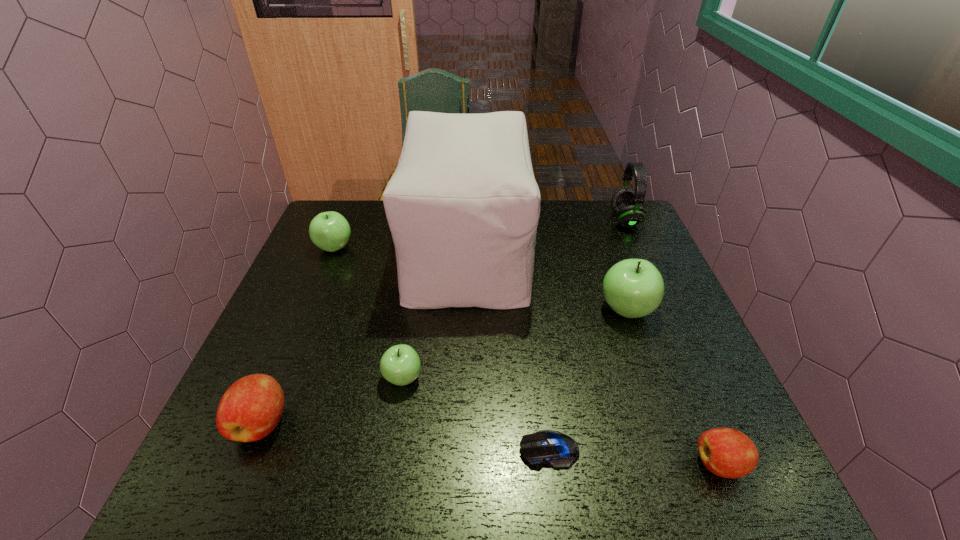
The height and width of the screenshot is (540, 960). I want to click on vacant region between the second farthest apple and the second green apple from left to right, so click(x=515, y=344).

The width and height of the screenshot is (960, 540). Identify the location of empty space between the computer mouse and the bigger red apple. (405, 436).

I want to click on empty space that is in between the right red apple and the second tallest object, so click(673, 342).

Locate an element on the screen. Image resolution: width=960 pixels, height=540 pixels. free space between the second biggest green apple and the right red apple is located at coordinates (527, 356).

The height and width of the screenshot is (540, 960). I want to click on free space between the white cushion and the computer mouse, so click(x=508, y=350).

The width and height of the screenshot is (960, 540). Identify the location of vacant space in between the third farthest apple and the shortest object. (476, 414).

Locate an element on the screen. This screenshot has width=960, height=540. free space between the left red apple and the farthest apple is located at coordinates (298, 335).

This screenshot has height=540, width=960. Identify the location of free space between the bigger red apple and the smaller red apple. (491, 443).

The height and width of the screenshot is (540, 960). Identify the location of the second closest object relative to the farthest apple. (400, 365).

Where is `object identified as the closest to the computer mouse`? This screenshot has width=960, height=540. object identified as the closest to the computer mouse is located at coordinates (729, 453).